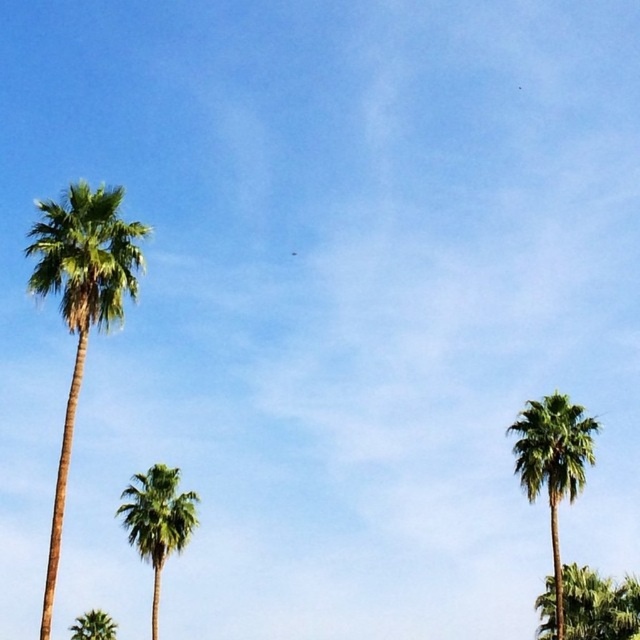
Question: Which of the following is the farthest from the observer?

Choices:
 (A) green leafy palm tree at left
 (B) green leafy palm tree at lower left
 (C) green leafy palm at center
 (D) green leafy palm at lower right

Answer: (B)

Question: Estimate the real-world distances between objects in this image. Which object is farther from the green leafy palm tree at lower left?

Choices:
 (A) green leafy palm tree at left
 (B) green leafy palm at center

Answer: (A)

Question: Is green leafy palm tree at right positioned before green leafy palm at center?

Choices:
 (A) yes
 (B) no

Answer: (A)

Question: Considering the relative positions of green leafy palm tree at right and green leafy palm tree at lower left in the image provided, where is green leafy palm tree at right located with respect to green leafy palm tree at lower left?

Choices:
 (A) left
 (B) right

Answer: (B)

Question: Which point is closer to the camera taking this photo?

Choices:
 (A) (154, 484)
 (B) (561, 570)

Answer: (B)

Question: Is green leafy palm tree at left bigger than green leafy palm at center?

Choices:
 (A) yes
 (B) no

Answer: (B)